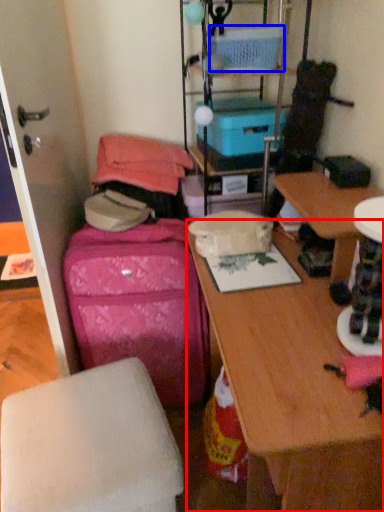
Question: Which of the following is the farthest to the observer, desk (highlighted by a red box) or storage box (highlighted by a blue box)?

Choices:
 (A) desk
 (B) storage box

Answer: (B)